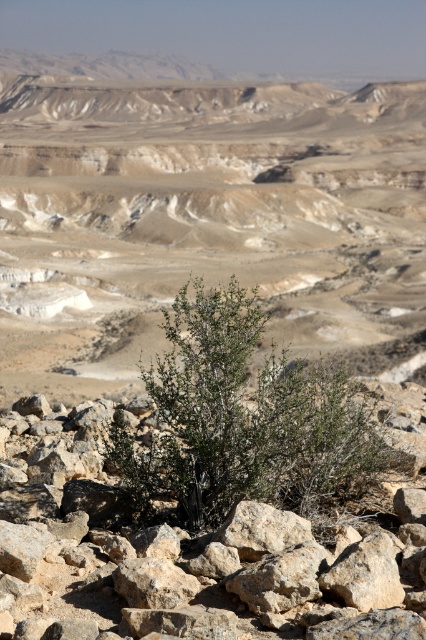
You are standing in the desert and see two points marked in the image. Which point is closer to you, point [37,637] or point [296,376]?

Point [37,637] is in front of point [296,376], so it is closer to you.

You are standing in the desert and see the rough textured rock at center and the green leafy shrub at center. Which object is positioned to the right of the other?

The rough textured rock at center is to the right of the green leafy shrub at center.

You are standing in the desert and see the rough textured rock at center and the green leafy shrub at center. Which object is nearer to you?

The rough textured rock at center is closer to the viewer than the green leafy shrub at center.